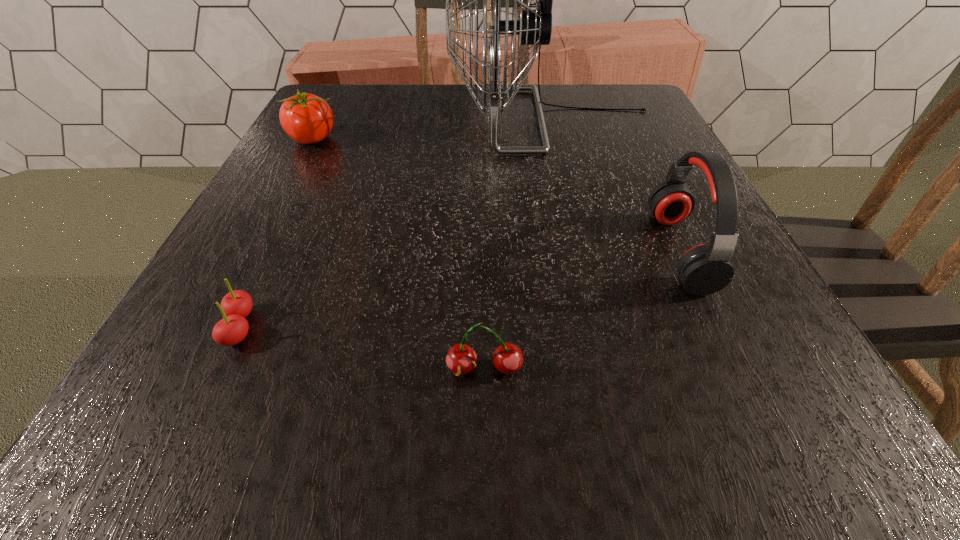
The height and width of the screenshot is (540, 960). What are the coordinates of `vacant area located 0.250m on the front-facing side of the fan` in the screenshot? It's located at (343, 120).

At what (x,y) coordinates should I click in order to perform the action: click on vacant space situated on the ear cups of the second tallest object. Please return your answer as a coordinate pair (x, y). Image resolution: width=960 pixels, height=540 pixels. Looking at the image, I should click on (602, 251).

Where is `vacant area located on the ear cups of the second tallest object`? vacant area located on the ear cups of the second tallest object is located at coordinates (614, 251).

Where is `vacant area situated on the ear cups of the second tallest object`? vacant area situated on the ear cups of the second tallest object is located at coordinates (502, 251).

Locate an element on the screen. Image resolution: width=960 pixels, height=540 pixels. free space located 0.140m on the right of the tomato is located at coordinates (403, 139).

Where is `vacant position located with stems pointing upwards on the taller cherry`? The width and height of the screenshot is (960, 540). vacant position located with stems pointing upwards on the taller cherry is located at coordinates [x=485, y=422].

You are a GUI agent. You are given a task and a screenshot of the screen. Output one action in this format:
    pyautogui.click(x=<x>, y=<y>)
    Task: Click on the free spot located 0.050m on the front of the shortest object
    The width and height of the screenshot is (960, 540).
    Given the screenshot: What is the action you would take?
    pyautogui.click(x=211, y=387)

This screenshot has height=540, width=960. I want to click on fan located at the far edge, so click(x=534, y=27).

You are a GUI agent. You are given a task and a screenshot of the screen. Output one action in this format:
    pyautogui.click(x=<x>, y=<y>)
    Task: Click on the tomato that is at the far edge
    This screenshot has height=540, width=960.
    Given the screenshot: What is the action you would take?
    pyautogui.click(x=306, y=118)

You are a GUI agent. You are given a task and a screenshot of the screen. Output one action in this format:
    pyautogui.click(x=<x>, y=<y>)
    Task: Click on the tomato that is at the left edge
    The width and height of the screenshot is (960, 540).
    Given the screenshot: What is the action you would take?
    pos(306,118)